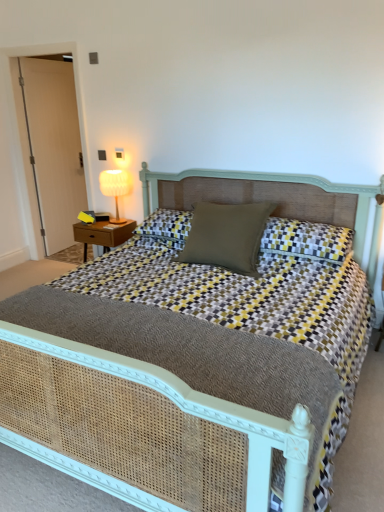
This screenshot has width=384, height=512. In order to click on white wood door at left in this screenshot , I will do `click(55, 146)`.

At what (x,y) coordinates should I click in order to perform the action: click on yellow-and-gray checkered pillow at center, the first pillow viewed from the right. Please return your answer as a coordinate pair (x, y). This screenshot has height=512, width=384. Looking at the image, I should click on (307, 240).

The width and height of the screenshot is (384, 512). In order to click on white fabric lampshade at upper left in this screenshot , I will do `click(115, 188)`.

You are a GUI agent. You are given a task and a screenshot of the screen. Output one action in this format:
    pyautogui.click(x=<x>, y=<y>)
    Task: Click on the white wood door at left
    The image size is (384, 512).
    Given the screenshot: What is the action you would take?
    pyautogui.click(x=55, y=146)

Can you confirm if wooden nightstand at left is positioned to the right of woven cane bed at center?

No.

Are wooden nightstand at left and woven cane bed at center located far from each other?

Yes, wooden nightstand at left and woven cane bed at center are quite far apart.

Is wooden nightstand at left positioned with its back to woven cane bed at center?

No, wooden nightstand at left is not facing the opposite direction of woven cane bed at center.

Considering the sizes of objects wooden nightstand at left and woven cane bed at center in the image provided, who is wider, wooden nightstand at left or woven cane bed at center?

With larger width is woven cane bed at center.

Is yellow-and-gray checkered pillow at center, the 2th pillow when ordered from left to right, positioned beyond the bounds of white fabric lampshade at upper left?

Yes.

Considering the relative sizes of yellow-and-gray checkered pillow at center, the first pillow viewed from the right, and white fabric lampshade at upper left in the image provided, is yellow-and-gray checkered pillow at center, the first pillow viewed from the right, bigger than white fabric lampshade at upper left?

Correct, yellow-and-gray checkered pillow at center, the first pillow viewed from the right, is larger in size than white fabric lampshade at upper left.

Looking at their sizes, would you say yellow-and-gray checkered pillow at center, the 2th pillow when ordered from left to right, is wider or thinner than white fabric lampshade at upper left?

Considering their sizes, yellow-and-gray checkered pillow at center, the 2th pillow when ordered from left to right, looks broader than white fabric lampshade at upper left.

Can you tell me how much yellow-and-gray checkered pillow at center, the first pillow viewed from the right, and white fabric lampshade at upper left differ in facing direction?

yellow-and-gray checkered pillow at center, the first pillow viewed from the right, and white fabric lampshade at upper left are facing 0.467 degrees away from each other.

Considering the relative positions of white wood door at left and white fabric lampshade at upper left in the image provided, is white wood door at left to the left of white fabric lampshade at upper left from the viewer's perspective?

Yes, white wood door at left is to the left of white fabric lampshade at upper left.

Can we say white wood door at left lies outside white fabric lampshade at upper left?

Yes, white wood door at left is located beyond the bounds of white fabric lampshade at upper left.

Is white wood door at left not close to white fabric lampshade at upper left?

That's right, there is a large distance between white wood door at left and white fabric lampshade at upper left.

Can we say matte green pillow at center, the second pillow viewed from the right, lies outside white wood door at left?

Absolutely, matte green pillow at center, the second pillow viewed from the right, is external to white wood door at left.

Is matte green pillow at center, the second pillow viewed from the right, oriented away from white wood door at left?

That's not correct — matte green pillow at center, the second pillow viewed from the right, is not looking away from white wood door at left.

Which object is closer to the camera, white fabric lampshade at upper left or yellow-and-gray checkered pillow at center, the 2th pillow when ordered from left to right?

yellow-and-gray checkered pillow at center, the 2th pillow when ordered from left to right, is closer to the camera.

Which is closer to the camera, (104, 188) or (301, 229)?

Result: Point (104, 188) is positioned farther from the camera compared to point (301, 229).

Based on their positions, is white fabric lampshade at upper left located to the left or right of yellow-and-gray checkered pillow at center, the 2th pillow when ordered from left to right?

Clearly, white fabric lampshade at upper left is on the left of yellow-and-gray checkered pillow at center, the 2th pillow when ordered from left to right, in the image.

Looking at this image, does white fabric lampshade at upper left contain yellow-and-gray checkered pillow at center, the 2th pillow when ordered from left to right?

No, yellow-and-gray checkered pillow at center, the 2th pillow when ordered from left to right, is not surrounded by white fabric lampshade at upper left.

Measure the distance between yellow-and-gray checkered pillow at center, the 2th pillow when ordered from left to right, and wooden nightstand at left.

yellow-and-gray checkered pillow at center, the 2th pillow when ordered from left to right, is 4.72 feet from wooden nightstand at left.

Is point (305, 222) positioned after point (125, 236)?

No.

Is yellow-and-gray checkered pillow at center, the first pillow viewed from the right, to the right of wooden nightstand at left from the viewer's perspective?

Correct, you'll find yellow-and-gray checkered pillow at center, the first pillow viewed from the right, to the right of wooden nightstand at left.

Consider the image. Does yellow-and-gray checkered pillow at center, the 2th pillow when ordered from left to right, have a smaller size compared to wooden nightstand at left?

No.

Which of these two, wooden nightstand at left or yellow-and-gray checkered pillow at center, the first pillow viewed from the right, is bigger?

yellow-and-gray checkered pillow at center, the first pillow viewed from the right.

Considering the positions of point (103, 234) and point (311, 256), is point (103, 234) closer or farther from the camera than point (311, 256)?

Point (103, 234).

Which object is more forward, wooden nightstand at left or yellow-and-gray checkered pillow at center, the first pillow viewed from the right?

yellow-and-gray checkered pillow at center, the first pillow viewed from the right, is in front.

This screenshot has width=384, height=512. In order to click on nightstand below the yellow-and-gray checkered pillow at center, the first pillow viewed from the right (from the image's perspective) in this screenshot , I will do `click(103, 234)`.

The image size is (384, 512). I want to click on nightstand on the left of woven cane bed at center, so click(103, 234).

Find the location of a particular element. This screenshot has width=384, height=512. table lamp located above the yellow-and-gray checkered pillow at center, the 2th pillow when ordered from left to right (from the image's perspective) is located at coordinates (115, 188).

Which object lies nearer to the anchor point white fabric lampshade at upper left, yellow-and-gray checkered pillow at center, the 2th pillow when ordered from left to right, or wooden nightstand at left?

wooden nightstand at left.

Considering their positions, is wooden nightstand at left positioned further to white fabric lampshade at upper left than matte green pillow at center, the second pillow viewed from the right?

matte green pillow at center, the second pillow viewed from the right, is further to white fabric lampshade at upper left.

Based on their spatial positions, is wooden nightstand at left or yellow-and-gray checkered pillow at center, the first pillow viewed from the right, further from white fabric lampshade at upper left?

yellow-and-gray checkered pillow at center, the first pillow viewed from the right, is further to white fabric lampshade at upper left.

Looking at the image, which one is located closer to wooden nightstand at left, woven cane bed at center or matte green pillow at center, marked as the first pillow in a left-to-right arrangement?

matte green pillow at center, marked as the first pillow in a left-to-right arrangement, lies closer to wooden nightstand at left than the other object.

When comparing their distances from yellow-and-gray checkered pillow at center, the 2th pillow when ordered from left to right, does white fabric lampshade at upper left or matte green pillow at center, the second pillow viewed from the right, seem closer?

Result: matte green pillow at center, the second pillow viewed from the right, lies closer to yellow-and-gray checkered pillow at center, the 2th pillow when ordered from left to right, than the other object.

When comparing their distances from woven cane bed at center, does white fabric lampshade at upper left or yellow-and-gray checkered pillow at center, the 2th pillow when ordered from left to right, seem further?

white fabric lampshade at upper left.

Considering their positions, is yellow-and-gray checkered pillow at center, the first pillow viewed from the right, positioned closer to white wood door at left than white fabric lampshade at upper left?

Based on the image, white fabric lampshade at upper left appears to be nearer to white wood door at left.

Looking at the image, which one is located further to woven cane bed at center, white fabric lampshade at upper left or white wood door at left?

white wood door at left.

At what (x,y) coordinates should I click in order to perform the action: click on table lamp located between wooden nightstand at left and yellow-and-gray checkered pillow at center, the first pillow viewed from the right, in the left-right direction. Please return your answer as a coordinate pair (x, y). Looking at the image, I should click on (115, 188).

Locate an element on the screen. This screenshot has height=512, width=384. table lamp between matte green pillow at center, the second pillow viewed from the right, and wooden nightstand at left from front to back is located at coordinates (115, 188).

Where is `pillow situated between white wood door at left and yellow-and-gray checkered pillow at center, the first pillow viewed from the right, from left to right`? This screenshot has height=512, width=384. pillow situated between white wood door at left and yellow-and-gray checkered pillow at center, the first pillow viewed from the right, from left to right is located at coordinates (227, 236).

Image resolution: width=384 pixels, height=512 pixels. I want to click on pillow situated between wooden nightstand at left and yellow-and-gray checkered pillow at center, the 2th pillow when ordered from left to right, from left to right, so click(227, 236).